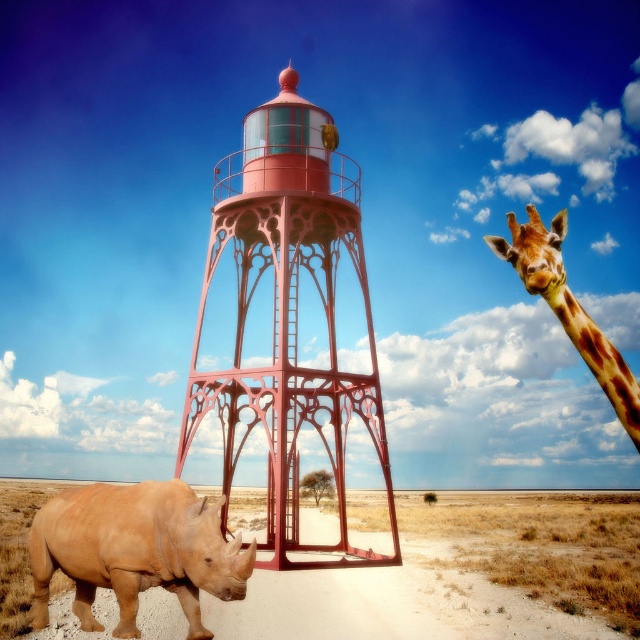
Question: Among these points, which one is nearest to the camera?

Choices:
 (A) (214, 198)
 (B) (531, 260)
 (C) (218, 593)

Answer: (C)

Question: Which point is farther to the camera?

Choices:
 (A) spotted fur giraffe at upper right
 (B) metallic pink tower at center

Answer: (B)

Question: Is light brown matte rhinoceros at lower left to the right of spotted fur giraffe at upper right from the viewer's perspective?

Choices:
 (A) no
 (B) yes

Answer: (A)

Question: Which object is the farthest from the spotted fur giraffe at upper right?

Choices:
 (A) light brown matte rhinoceros at lower left
 (B) metallic pink tower at center

Answer: (A)

Question: Can you confirm if light brown matte rhinoceros at lower left is wider than spotted fur giraffe at upper right?

Choices:
 (A) no
 (B) yes

Answer: (A)

Question: Does light brown matte rhinoceros at lower left lie in front of spotted fur giraffe at upper right?

Choices:
 (A) no
 (B) yes

Answer: (A)